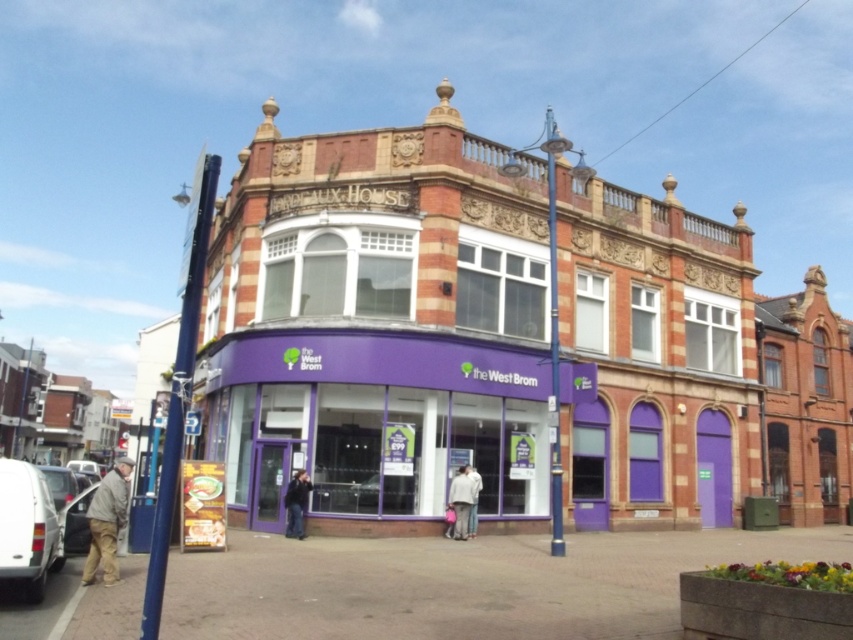
Question: Observing the image, what is the correct spatial positioning of purple matte building at center in reference to purple matte bank at center?

Choices:
 (A) left
 (B) right

Answer: (B)

Question: Is purple matte building at center behind purple matte bank at center?

Choices:
 (A) no
 (B) yes

Answer: (A)

Question: Does purple matte building at center have a larger size compared to purple matte bank at center?

Choices:
 (A) yes
 (B) no

Answer: (A)

Question: Which point is closer to the camera taking this photo?

Choices:
 (A) (271, 412)
 (B) (582, 298)

Answer: (A)